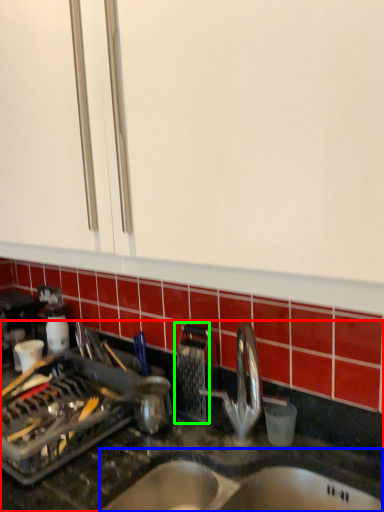
Question: Which object is positioned closest to countertop (highlighted by a red box)? Select from sink (highlighted by a blue box) and appliance (highlighted by a green box).

Choices:
 (A) sink
 (B) appliance

Answer: (A)